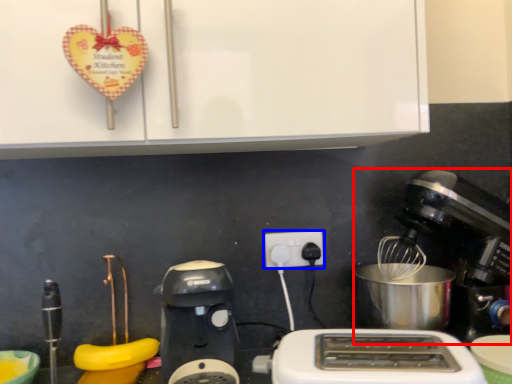
Question: Among these objects, which one is nearest to the camera, mixer (highlighted by a red box) or power plugs and sockets (highlighted by a blue box)?

Choices:
 (A) mixer
 (B) power plugs and sockets

Answer: (A)